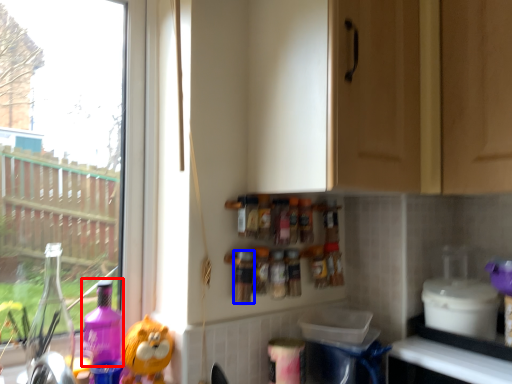
Question: Which of the following is the closest to the observer, cleaning product (highlighted by a red box) or bottle (highlighted by a blue box)?

Choices:
 (A) cleaning product
 (B) bottle

Answer: (A)